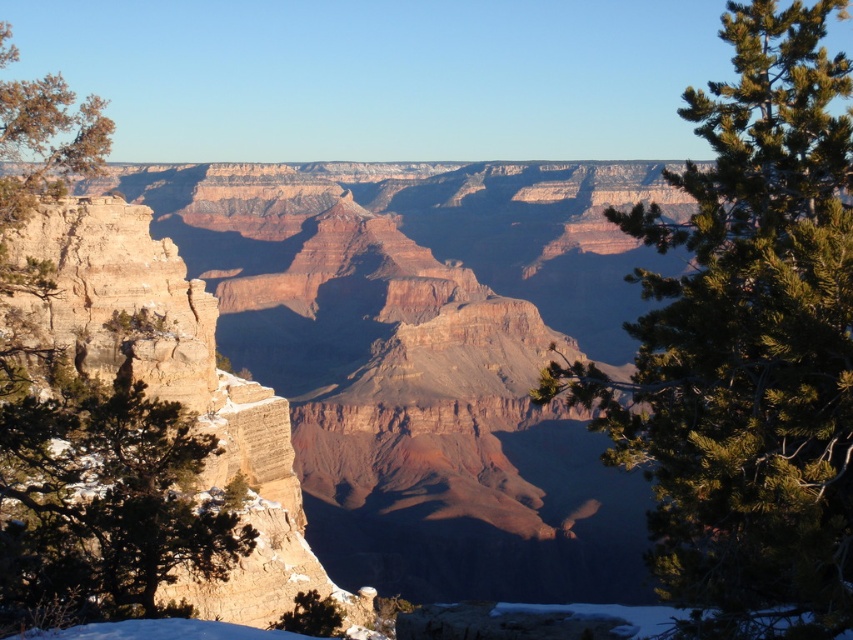
Question: From the image, what is the correct spatial relationship of green needle-like tree at right in relation to green textured tree at left?

Choices:
 (A) right
 (B) left

Answer: (A)

Question: Is green needle-like tree at right positioned behind green textured tree at left?

Choices:
 (A) no
 (B) yes

Answer: (A)

Question: Does green needle-like tree at right have a larger size compared to green textured tree at left?

Choices:
 (A) no
 (B) yes

Answer: (B)

Question: Which of the following is the farthest from the observer?

Choices:
 (A) coord(799,284)
 (B) coord(177,611)

Answer: (B)